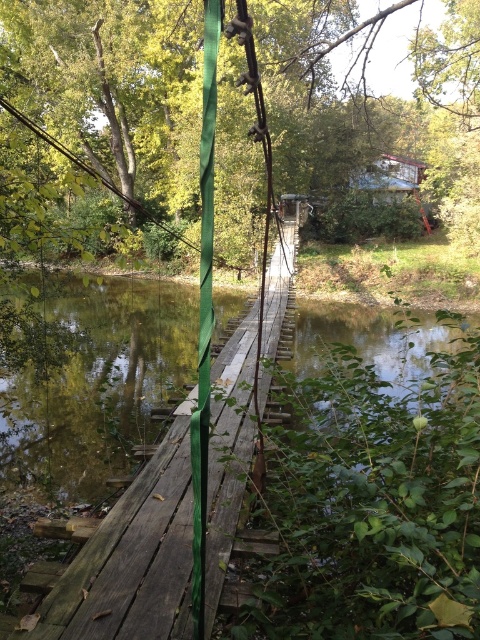
You are standing at the starting point of the green wooden bridge at center. If you walk straight ahead, which direction will you be facing relative to the bridge?

Since the green wooden bridge at center is located at point (x=92, y=380), walking straight ahead along the bridge would mean moving towards the direction of the structure visible in the distance, which is the small building beyond the bridge.

You are standing on the suspension bridge and notice a point marked at coordinates (92, 380). What object is located at this point?

The point at coordinates (92, 380) corresponds to the green wooden bridge at center.

You are standing on a path near the green wooden bridge at center. You want to cross the bridge to reach the small building on the other side. If your walking speed is 1.2 meters per second, how many seconds will it take you to reach the bridge?

The green wooden bridge at center is 5.67 meters away from the viewer. At a walking speed of 1.2 meters per second, it would take approximately 4.725 seconds to reach the bridge. Since the question asks for seconds, rounding to two decimal places, it would be about 4.73 seconds.